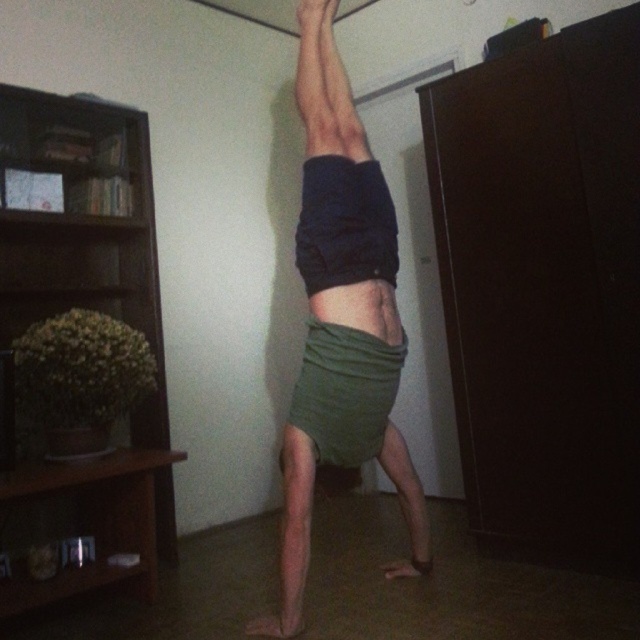
You are trying to locate the green fabric shorts at center in an image. Based on the coordinate system where the bottom left corner is the origin, can you determine if it is closer to the center of the image or the right edge?

The green fabric shorts at center is located at point (340, 317), which is very close to the center of the image. Therefore, it is closer to the center than the right edge.

You are standing in the room where the person is doing a handstand. If you want to place a small plant on the brown wooden bookshelf at left, where exactly should you place it?

The brown wooden bookshelf at left is located at point (81, 349), so you should place the small plant there.